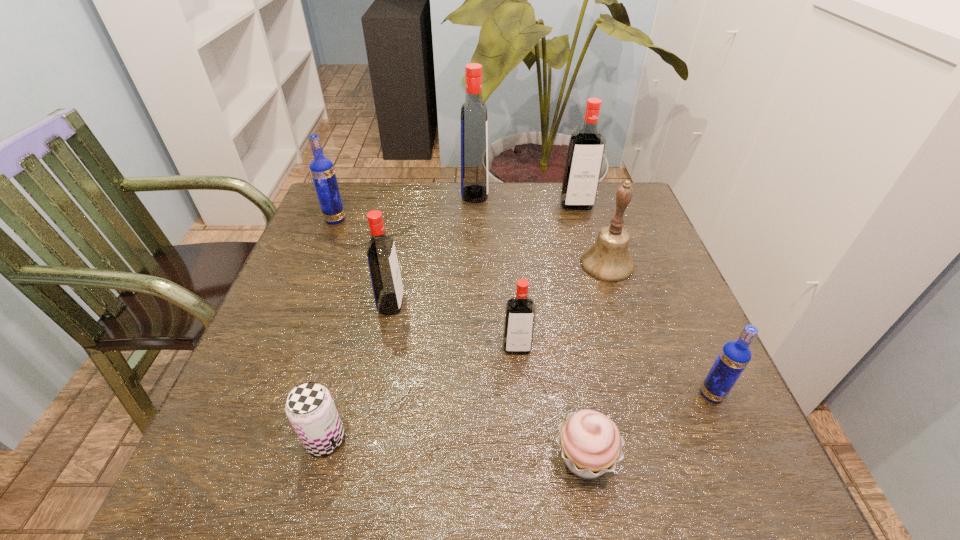
The width and height of the screenshot is (960, 540). I want to click on vacant position located 0.370m on the front and back of the seventh object from right to left, so click(571, 304).

You are a GUI agent. You are given a task and a screenshot of the screen. Output one action in this format:
    pyautogui.click(x=<x>, y=<y>)
    Task: Click on the vacant point located 0.380m on the front of the bell
    The image size is (960, 540).
    Given the screenshot: What is the action you would take?
    pyautogui.click(x=662, y=437)

This screenshot has height=540, width=960. In order to click on free space located 0.220m on the back of the nearer blue vodka in this screenshot , I will do `click(670, 299)`.

Locate an element on the screen. The height and width of the screenshot is (540, 960). vacant area located 0.070m on the front and back of the third red vodka from left to right is located at coordinates (520, 386).

Identify the location of free space located on the front of the beer can. (309, 497).

At what (x,y) coordinates should I click in order to perform the action: click on free location located on the back of the sixth object from left to right. Please return your answer as a coordinate pair (x, y). Looking at the image, I should click on (554, 282).

Find the location of a particular element. beer can that is at the near edge is located at coordinates (310, 408).

Image resolution: width=960 pixels, height=540 pixels. Find the location of `cupcake located at the near edge`. cupcake located at the near edge is located at coordinates (590, 443).

The image size is (960, 540). I want to click on vodka situated at the left edge, so click(322, 171).

Image resolution: width=960 pixels, height=540 pixels. Find the location of `beer can located at the left edge`. beer can located at the left edge is located at coordinates (310, 408).